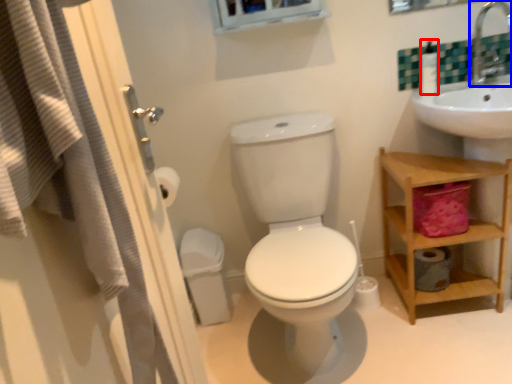
Question: Among these objects, which one is nearest to the camera, soap dispenser (highlighted by a red box) or faucet (highlighted by a blue box)?

Choices:
 (A) soap dispenser
 (B) faucet

Answer: (B)